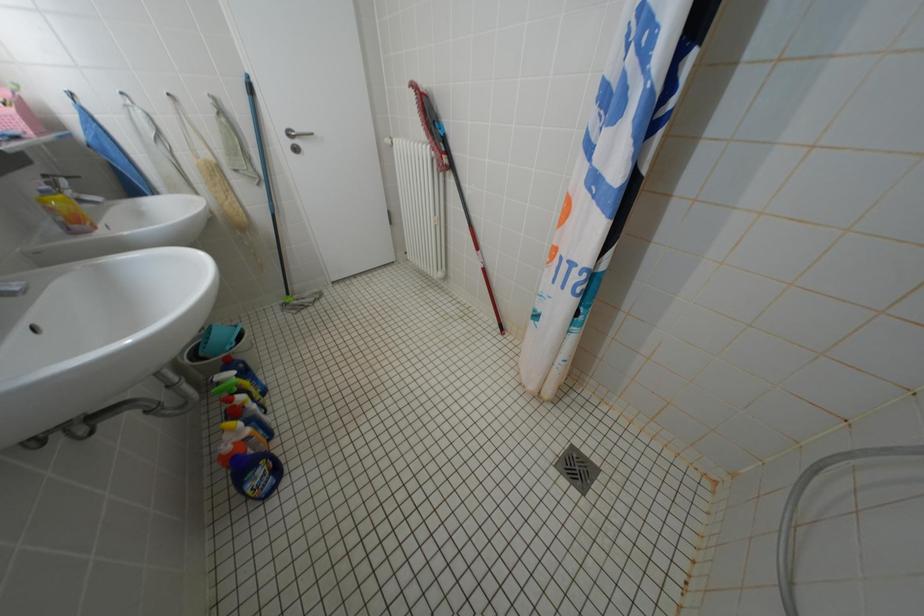
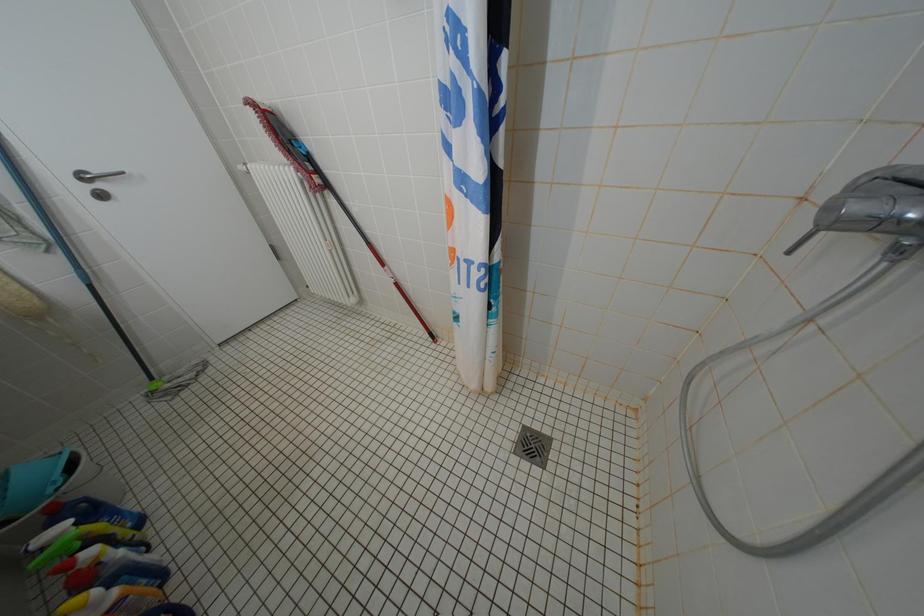
Question: The camera is either moving clockwise (left) or counter-clockwise (right) around the object. The first image is from the beginning of the video and the second image is from the end. Is the camera moving left or right when shooting the video?

Choices:
 (A) Left
 (B) Right

Answer: (A)